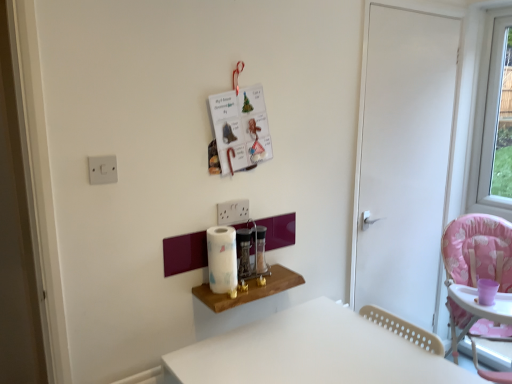
Question: Can you confirm if white plastic electric outlet at upper left is wider than white matte table at lower center, marked as the 2th table in a left-to-right arrangement?

Choices:
 (A) no
 (B) yes

Answer: (A)

Question: Can you confirm if white plastic electric outlet at upper left is positioned to the right of white matte table at lower center, which ranks as the second table in top-to-bottom order?

Choices:
 (A) yes
 (B) no

Answer: (B)

Question: Does white plastic electric outlet at upper left lie behind white matte table at lower center, marked as the 2th table in a left-to-right arrangement?

Choices:
 (A) no
 (B) yes

Answer: (B)

Question: Could you tell me if white plastic electric outlet at upper left is turned towards white matte table at lower center, marked as the 2th table in a left-to-right arrangement?

Choices:
 (A) yes
 (B) no

Answer: (B)

Question: Is white plastic electric outlet at upper left facing away from white matte table at lower center, which appears as the first table when viewed from the right?

Choices:
 (A) yes
 (B) no

Answer: (B)

Question: Does white plastic electric outlet at upper left come in front of white matte table at lower center, the first table in the bottom-to-top sequence?

Choices:
 (A) no
 (B) yes

Answer: (A)

Question: Is transparent glass window at upper right bigger than translucent glass spice jar at center, positioned as the 1th appliance in right-to-left order?

Choices:
 (A) no
 (B) yes

Answer: (B)

Question: From the image's perspective, is transparent glass window at upper right located beneath translucent glass spice jar at center, positioned as the 1th appliance in right-to-left order?

Choices:
 (A) no
 (B) yes

Answer: (A)

Question: From the image's perspective, would you say transparent glass window at upper right is positioned over translucent glass spice jar at center, positioned as the 2th appliance in left-to-right order?

Choices:
 (A) yes
 (B) no

Answer: (A)

Question: Is transparent glass window at upper right thinner than translucent glass spice jar at center, positioned as the 2th appliance in left-to-right order?

Choices:
 (A) no
 (B) yes

Answer: (A)

Question: Is transparent glass window at upper right beside translucent glass spice jar at center, positioned as the 2th appliance in left-to-right order?

Choices:
 (A) yes
 (B) no

Answer: (B)

Question: Is transparent glass window at upper right positioned with its back to translucent glass spice jar at center, positioned as the 1th appliance in right-to-left order?

Choices:
 (A) yes
 (B) no

Answer: (B)

Question: Is white matte door at right smaller than white matte table at lower center, which ranks as the second table in top-to-bottom order?

Choices:
 (A) yes
 (B) no

Answer: (A)